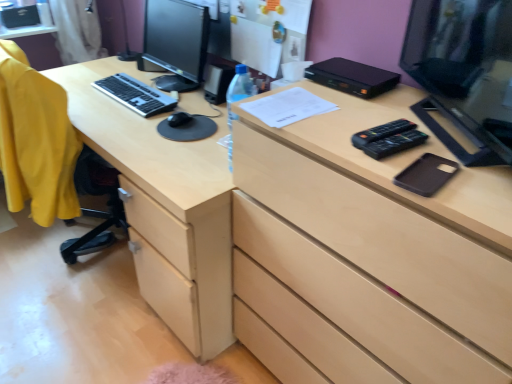
Where is `vacant space behind black matte phone case at right`? vacant space behind black matte phone case at right is located at coordinates (411, 132).